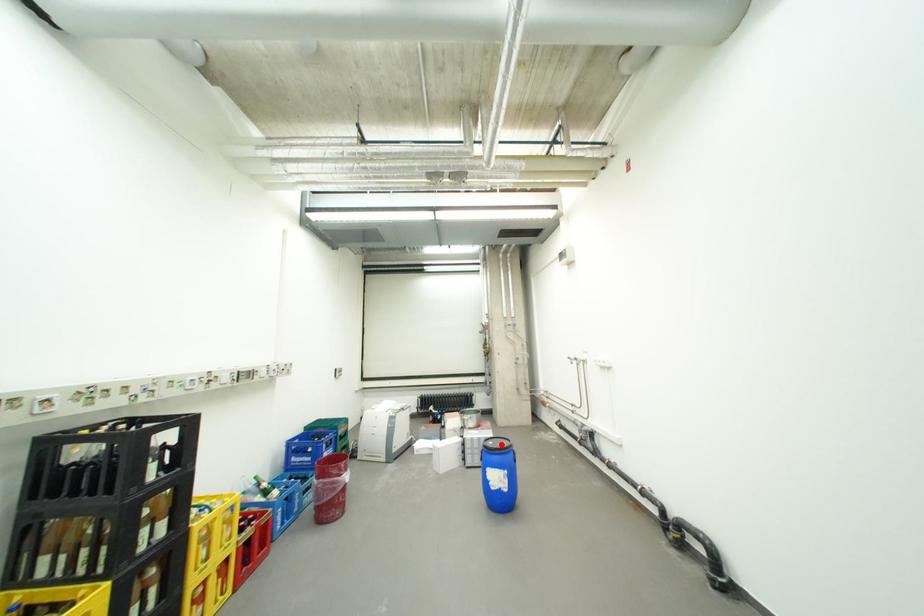
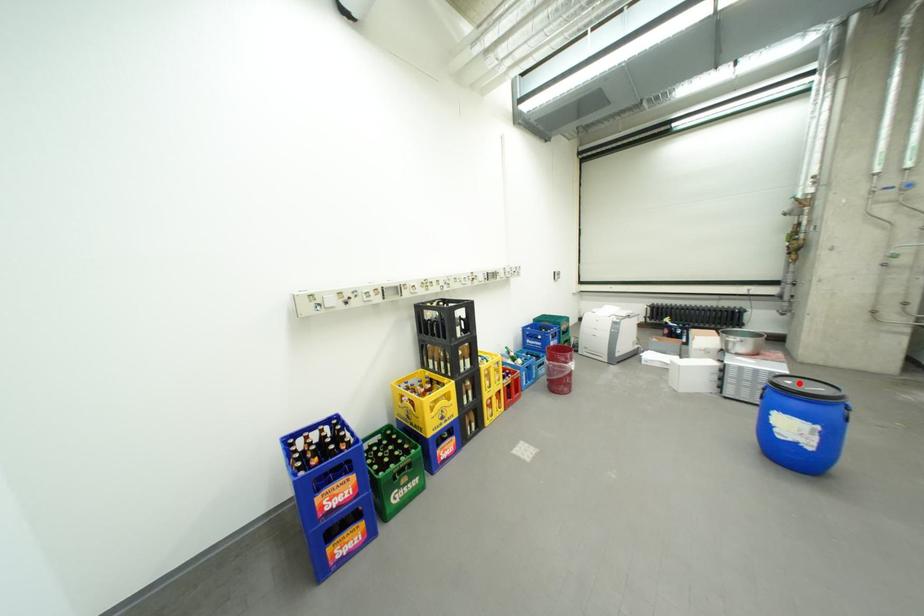
I am providing you with two images of the same scene from different viewpoints. A red point is marked on the first image and another point is marked on the second image. Are the points marked in image1 and image2 representing the same 3D position?

Yes